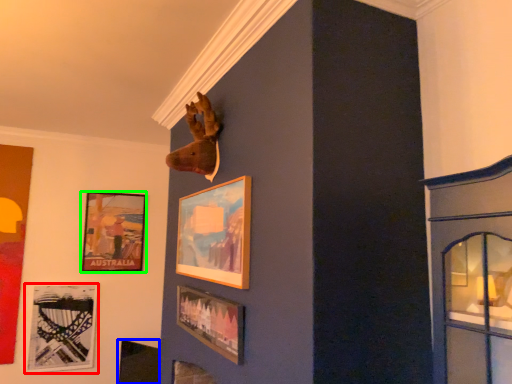
Question: Estimate the real-world distances between objects in this image. Which object is farther from picture frame (highlighted by a red box), picture frame (highlighted by a blue box) or picture frame (highlighted by a green box)?

Choices:
 (A) picture frame
 (B) picture frame

Answer: (B)